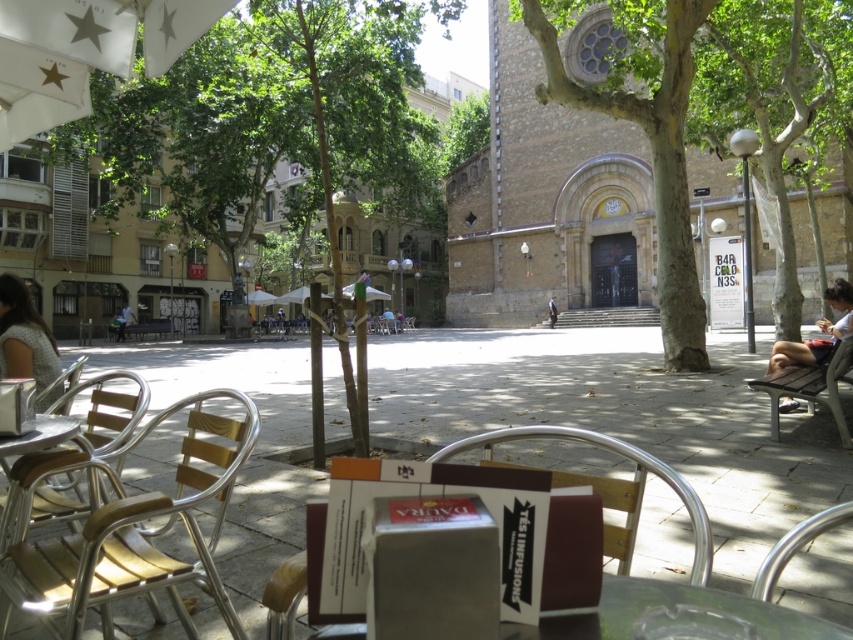
You are a customer at the outdoor cafe and want to sit down. There is a wooden chair at center and light blue denim shorts at right. Which object is narrower?

The wooden chair at center is narrower than the light blue denim shorts at right.

You are a customer at the outdoor cafe and want to sit at the metallic silver table at lower left. However, there is a gray fabric dress at lower left in the way. Can you walk around it to reach the table?

The metallic silver table at lower left is behind the gray fabric dress at lower left, so you can walk around the gray fabric dress at lower left to access the table.